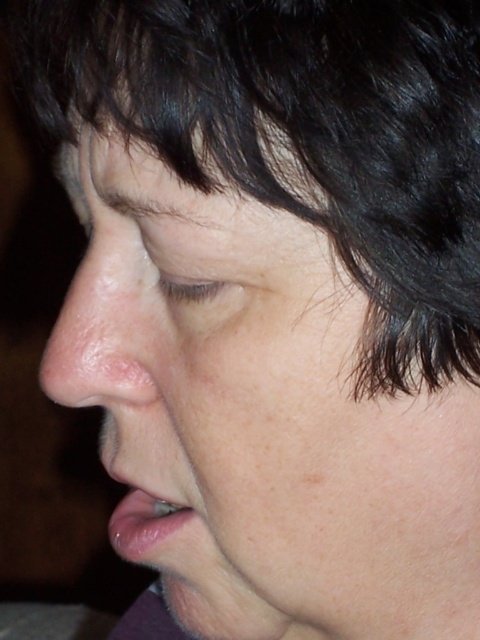
You are a photographer adjusting the focus on your camera. You notice two points in the image at coordinates point [106,262] and point [132,554]. Which point should you focus on to ensure the subject in the foreground is sharp?

You should focus on point [106,262] because it is in front of point [132,554], making it the closer point to the camera and thus the foreground subject.

You are a makeup artist preparing to apply lipstick. You notice the smooth skin nose at center and the glossy pink lips at lower left. Which object should you focus on to ensure the lipstick application is precise?

You should focus on the glossy pink lips at lower left because the smooth skin nose at center is in front of it, so applying lipstick on the glossy pink lips at lower left will ensure precision without obstruction.

You are a makeup artist preparing to apply lipstick. You need to ensure that the glossy pink lips at lower left are properly aligned with the smooth skin nose at center. Based on the image, which direction should you adjust the lips to achieve symmetry?

Answer: The smooth skin nose at center is to the left of glossy pink lips at lower left, so to achieve symmetry, you should move the glossy pink lips at lower left slightly to the right to align with the nose.